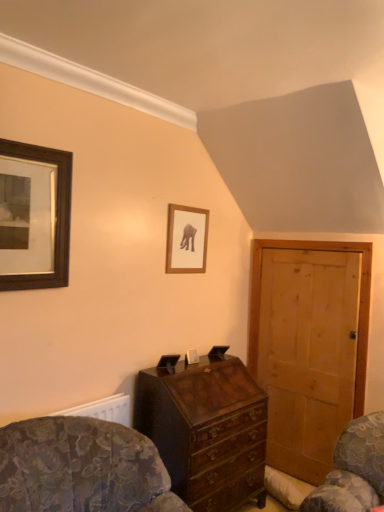
Identify the location of wooden framed picture at upper left, the first picture frame positioned from the front. The width and height of the screenshot is (384, 512). (34, 216).

In order to face patterned fabric rocking chair at lower left, should I rotate leftwards or rightwards?

You should rotate left by 11.018 degrees.

I want to click on wooden framed picture at upper left, the first picture frame positioned from the front, so click(34, 216).

Looking at this image, is mahogany wooden chest of drawers at center positioned before wooden framed picture at center, acting as the 2th picture frame starting from the front?

Yes, mahogany wooden chest of drawers at center is closer to the camera.

Considering the relative positions of mahogany wooden chest of drawers at center and wooden framed picture at center, the first picture frame positioned from the back, in the image provided, is mahogany wooden chest of drawers at center to the left of wooden framed picture at center, the first picture frame positioned from the back, from the viewer's perspective?

Incorrect, mahogany wooden chest of drawers at center is not on the left side of wooden framed picture at center, the first picture frame positioned from the back.

Based on the photo, which of these two, mahogany wooden chest of drawers at center or wooden framed picture at center, arranged as the 2th picture frame when viewed from the left, is wider?

mahogany wooden chest of drawers at center.

Consider the image. Which is more distant, (x=200, y=410) or (x=193, y=238)?

The point (x=193, y=238) is behind.

Between wooden framed picture at upper left, the first picture frame positioned from the front, and natural wood door at right, which one has more height?

Standing taller between the two is natural wood door at right.

Considering the sizes of wooden framed picture at upper left, placed as the 2th picture frame when sorted from right to left, and natural wood door at right in the image, is wooden framed picture at upper left, placed as the 2th picture frame when sorted from right to left, bigger or smaller than natural wood door at right?

wooden framed picture at upper left, placed as the 2th picture frame when sorted from right to left, is smaller than natural wood door at right.

Does wooden framed picture at upper left, which is the second picture frame in back-to-front order, come behind natural wood door at right?

No.

Choose the correct answer: Is wooden framed picture at center, arranged as the 2th picture frame when viewed from the left, inside patterned fabric rocking chair at lower left or outside it?

wooden framed picture at center, arranged as the 2th picture frame when viewed from the left, is located beyond the bounds of patterned fabric rocking chair at lower left.

Which is in front, point (192, 234) or point (69, 486)?

The point (69, 486) is closer to the camera.

Between wooden framed picture at center, arranged as the 2th picture frame when viewed from the left, and patterned fabric rocking chair at lower left, which one has smaller size?

wooden framed picture at center, arranged as the 2th picture frame when viewed from the left, is smaller.

From the image's perspective, which one is positioned lower, patterned fabric rocking chair at lower left or natural wood door at right?

patterned fabric rocking chair at lower left.

This screenshot has height=512, width=384. Find the location of `door above the patterned fabric rocking chair at lower left (from the image's perspective)`. door above the patterned fabric rocking chair at lower left (from the image's perspective) is located at coordinates (309, 346).

Is patterned fabric rocking chair at lower left oriented towards natural wood door at right?

No, patterned fabric rocking chair at lower left is not aimed at natural wood door at right.

Would you say patterned fabric rocking chair at lower left is a long distance from natural wood door at right?

Yes, patterned fabric rocking chair at lower left and natural wood door at right are located far from each other.

Is patterned fabric rocking chair at lower left oriented towards wooden framed picture at center, the first picture frame positioned from the back?

No, patterned fabric rocking chair at lower left is not aimed at wooden framed picture at center, the first picture frame positioned from the back.

Do you think patterned fabric rocking chair at lower left is within wooden framed picture at center, positioned as the 1th picture frame in right-to-left order, or outside of it?

patterned fabric rocking chair at lower left cannot be found inside wooden framed picture at center, positioned as the 1th picture frame in right-to-left order.

Measure the distance from patterned fabric rocking chair at lower left to wooden framed picture at center, arranged as the 2th picture frame when viewed from the left.

A distance of 4.41 feet exists between patterned fabric rocking chair at lower left and wooden framed picture at center, arranged as the 2th picture frame when viewed from the left.

Between patterned fabric rocking chair at lower left and wooden framed picture at center, the first picture frame positioned from the back, which one has more height?

With more height is patterned fabric rocking chair at lower left.

Based on the photo, do you think wooden framed picture at upper left, the first picture frame positioned from the front, is within mahogany wooden chest of drawers at center, or outside of it?

wooden framed picture at upper left, the first picture frame positioned from the front, is not enclosed by mahogany wooden chest of drawers at center.

In terms of width, does wooden framed picture at upper left, placed as the 2th picture frame when sorted from right to left, look wider or thinner when compared to mahogany wooden chest of drawers at center?

Clearly, wooden framed picture at upper left, placed as the 2th picture frame when sorted from right to left, has less width compared to mahogany wooden chest of drawers at center.

Considering the sizes of objects wooden framed picture at upper left, placed as the 2th picture frame when sorted from right to left, and mahogany wooden chest of drawers at center in the image provided, who is bigger, wooden framed picture at upper left, placed as the 2th picture frame when sorted from right to left, or mahogany wooden chest of drawers at center?

With larger size is mahogany wooden chest of drawers at center.

Is wooden framed picture at upper left, placed as the 2th picture frame when sorted from right to left, taller than mahogany wooden chest of drawers at center?

Incorrect, the height of wooden framed picture at upper left, placed as the 2th picture frame when sorted from right to left, is not larger of that of mahogany wooden chest of drawers at center.

Choose the correct answer: Is natural wood door at right inside wooden framed picture at upper left, the first picture frame positioned from the front, or outside it?

The correct answer is: outside.

In the scene shown: Is wooden framed picture at upper left, which is the second picture frame in back-to-front order, at the back of natural wood door at right?

natural wood door at right does not have its back to wooden framed picture at upper left, which is the second picture frame in back-to-front order.

In terms of width, does natural wood door at right look wider or thinner when compared to wooden framed picture at upper left, positioned as the first picture frame in left-to-right order?

Considering their sizes, natural wood door at right looks slimmer than wooden framed picture at upper left, positioned as the first picture frame in left-to-right order.

From a real-world perspective, is natural wood door at right below wooden framed picture at upper left, the first picture frame positioned from the front?

Yes, from a real-world perspective, natural wood door at right is beneath wooden framed picture at upper left, the first picture frame positioned from the front.

From the mahogany wooden chest of drawers at center, count the 1st picture frame to the left and point to it. Please provide its 2D coordinates.

[(186, 239)]

At what (x,y) coordinates should I click in order to perform the action: click on picture frame that is the 2nd object located in front of the natural wood door at right. Please return your answer as a coordinate pair (x, y). Image resolution: width=384 pixels, height=512 pixels. Looking at the image, I should click on (34, 216).

From the image, which object appears to be nearer to wooden framed picture at center, acting as the 2th picture frame starting from the front, mahogany wooden chest of drawers at center or wooden framed picture at upper left, placed as the 2th picture frame when sorted from right to left?

wooden framed picture at upper left, placed as the 2th picture frame when sorted from right to left, lies closer to wooden framed picture at center, acting as the 2th picture frame starting from the front, than the other object.

Considering their positions, is patterned fabric rocking chair at lower left positioned closer to mahogany wooden chest of drawers at center than wooden framed picture at center, positioned as the 1th picture frame in right-to-left order?

Based on the image, patterned fabric rocking chair at lower left appears to be nearer to mahogany wooden chest of drawers at center.

Based on their spatial positions, is patterned fabric rocking chair at lower left or natural wood door at right closer to mahogany wooden chest of drawers at center?

patterned fabric rocking chair at lower left.

Considering their positions, is mahogany wooden chest of drawers at center positioned closer to patterned fabric rocking chair at lower left than wooden framed picture at upper left, the first picture frame positioned from the front?

Among the two, mahogany wooden chest of drawers at center is located nearer to patterned fabric rocking chair at lower left.

When comparing their distances from natural wood door at right, does mahogany wooden chest of drawers at center or wooden framed picture at center, arranged as the 2th picture frame when viewed from the left, seem further?

The object further to natural wood door at right is wooden framed picture at center, arranged as the 2th picture frame when viewed from the left.

When comparing their distances from natural wood door at right, does mahogany wooden chest of drawers at center or wooden framed picture at upper left, which is the second picture frame in back-to-front order, seem further?

wooden framed picture at upper left, which is the second picture frame in back-to-front order, is positioned further to the anchor natural wood door at right.

Consider the image. Considering their positions, is natural wood door at right positioned further to wooden framed picture at upper left, positioned as the first picture frame in left-to-right order, than wooden framed picture at center, the first picture frame positioned from the back?

natural wood door at right lies further to wooden framed picture at upper left, positioned as the first picture frame in left-to-right order, than the other object.

Looking at the image, which one is located closer to wooden framed picture at center, arranged as the 2th picture frame when viewed from the left, patterned fabric rocking chair at lower left or wooden framed picture at upper left, positioned as the first picture frame in left-to-right order?

wooden framed picture at upper left, positioned as the first picture frame in left-to-right order.

The image size is (384, 512). What are the coordinates of `picture frame between wooden framed picture at upper left, the first picture frame positioned from the front, and natural wood door at right from left to right` in the screenshot? It's located at (186, 239).

The height and width of the screenshot is (512, 384). I want to click on door between wooden framed picture at center, arranged as the 2th picture frame when viewed from the left, and mahogany wooden chest of drawers at center, in the vertical direction, so click(x=309, y=346).

Where is `the chest of drawers positioned between patterned fabric rocking chair at lower left and natural wood door at right from near to far`? the chest of drawers positioned between patterned fabric rocking chair at lower left and natural wood door at right from near to far is located at coordinates (206, 430).

Find the location of `picture frame between patterned fabric rocking chair at lower left and wooden framed picture at center, the first picture frame positioned from the back, in the front-back direction`. picture frame between patterned fabric rocking chair at lower left and wooden framed picture at center, the first picture frame positioned from the back, in the front-back direction is located at coordinates (34, 216).